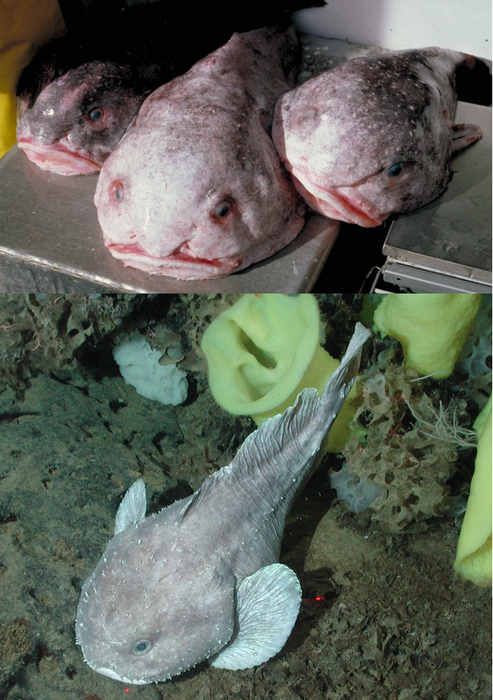
At what (x,y) coordinates should I click in order to perform the action: click on white wall. Please return your answer as a coordinate pair (x, y). This screenshot has height=700, width=493. Looking at the image, I should click on coord(418,24).